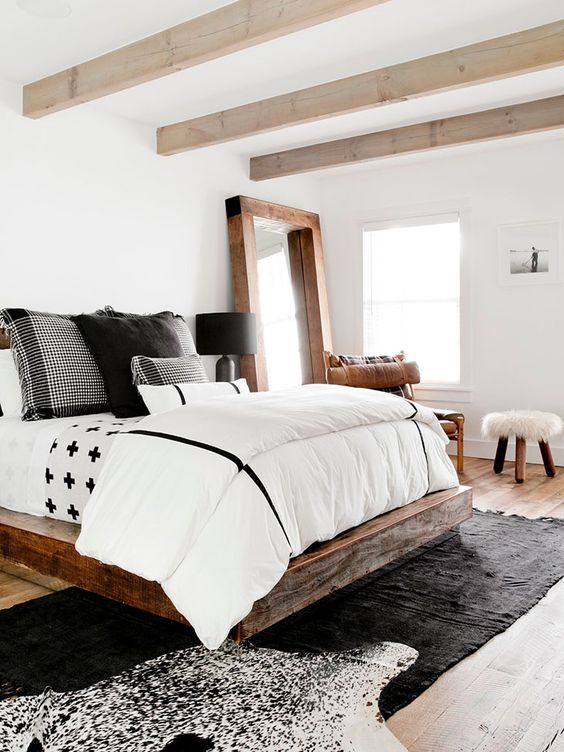
Find the location of `window`. window is located at coordinates (x=418, y=286).